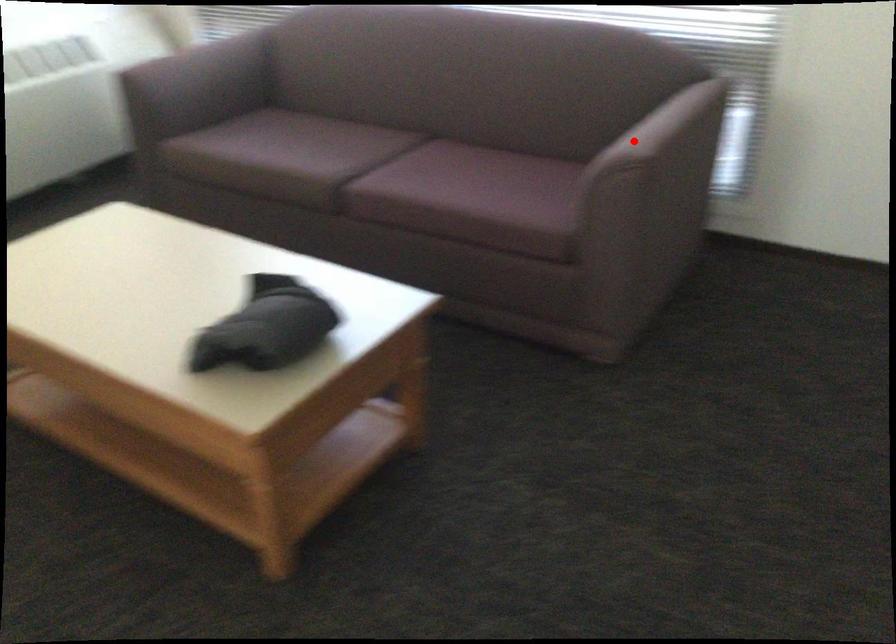
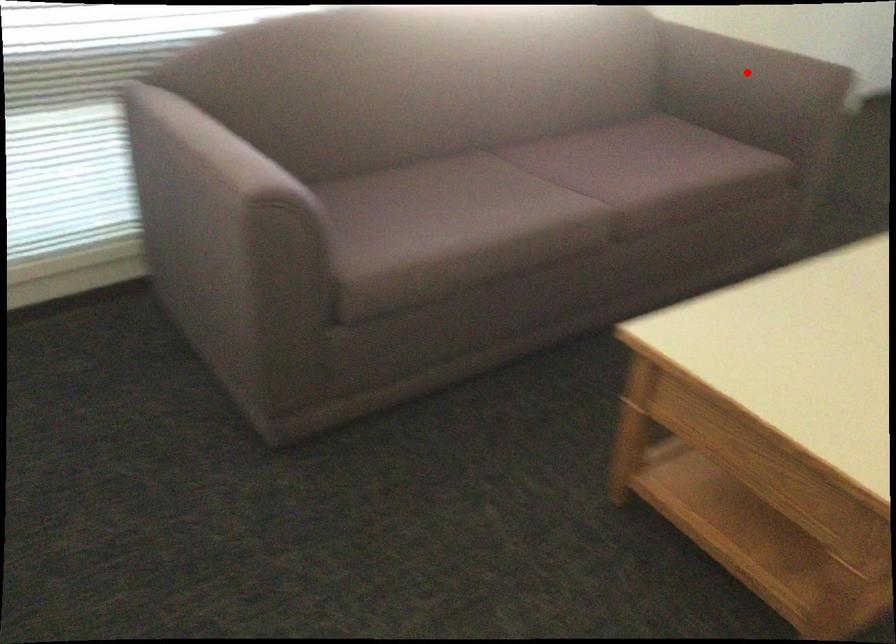
I am providing you with two images of the same scene from different viewpoints. A red point is marked on the first image and another point is marked on the second image. Is the red point in image1 aligned with the point shown in image2?

Yes